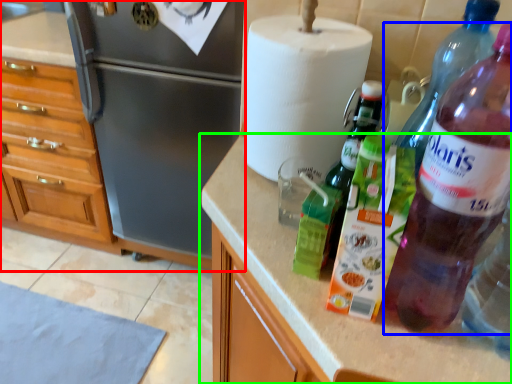
Question: Estimate the real-world distances between objects in this image. Which object is closer to cabinetry (highlighted by a red box), bottle (highlighted by a blue box) or countertop (highlighted by a green box)?

Choices:
 (A) bottle
 (B) countertop

Answer: (B)